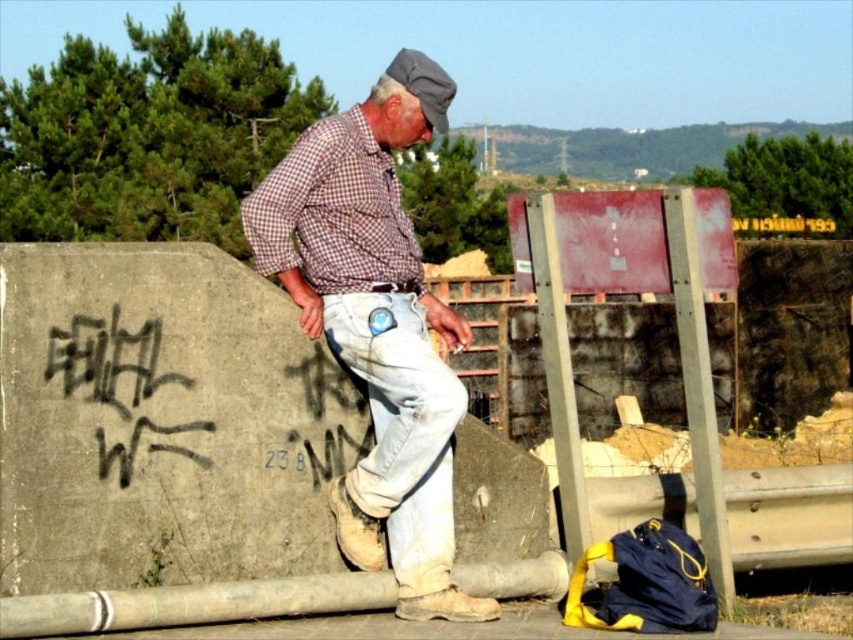
Can you confirm if checkered fabric shirt at center is bigger than black graffiti at left?

Yes.

Who is more distant from viewer, (340, 516) or (85, 353)?

The point (340, 516) is more distant.

Locate an element on the screen. The image size is (853, 640). checkered fabric shirt at center is located at coordinates (376, 324).